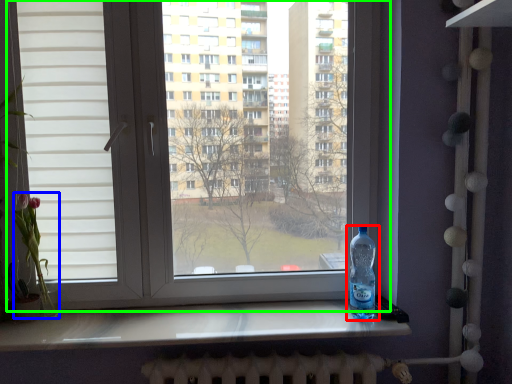
Question: Based on their relative distances, which object is farther from bottle (highlighted by a red box)? Choose from flower (highlighted by a blue box) and window (highlighted by a green box).

Choices:
 (A) flower
 (B) window

Answer: (A)